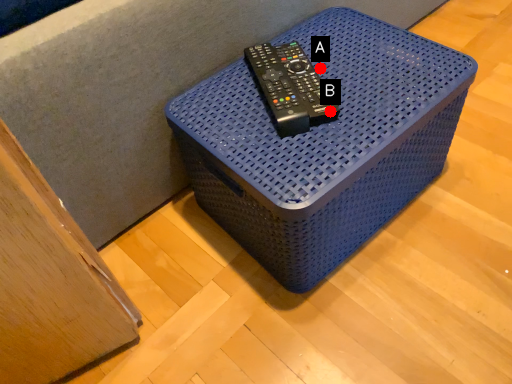
Question: Two points are circled on the image, labeled by A and B beside each circle. Which point is closer to the camera?

Choices:
 (A) A is closer
 (B) B is closer

Answer: (B)